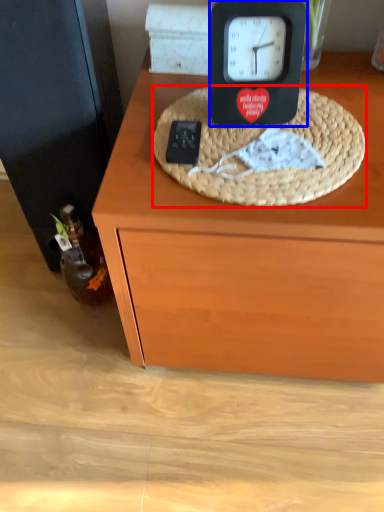
Question: Which point is closer to the camera, basket (highlighted by a red box) or clock (highlighted by a blue box)?

Choices:
 (A) basket
 (B) clock

Answer: (A)